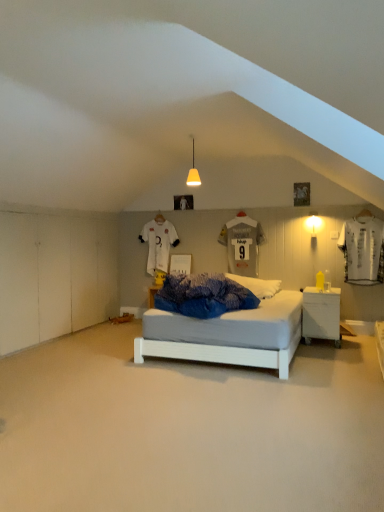
Question: Does white soft pillow at center have a greater height compared to gray matte jersey at center, arranged as the second t shirt when viewed from the back?

Choices:
 (A) yes
 (B) no

Answer: (B)

Question: Is white soft pillow at center in contact with gray matte jersey at center, arranged as the second t shirt when viewed from the back?

Choices:
 (A) yes
 (B) no

Answer: (B)

Question: Is white soft pillow at center oriented towards gray matte jersey at center, the first t shirt in the right-to-left sequence?

Choices:
 (A) yes
 (B) no

Answer: (B)

Question: Is gray matte jersey at center, which is the 2th t shirt in left-to-right order, a part of white soft pillow at center?

Choices:
 (A) no
 (B) yes

Answer: (A)

Question: Is white soft pillow at center far from gray matte jersey at center, arranged as the second t shirt when viewed from the back?

Choices:
 (A) no
 (B) yes

Answer: (A)

Question: Does white soft pillow at center have a lesser width compared to gray matte jersey at center, the 1th t shirt when ordered from front to back?

Choices:
 (A) no
 (B) yes

Answer: (A)

Question: From a real-world perspective, is white jersey at upper center, the 2th t shirt when ordered from front to back, physically below white matte wall sconce at right, which ranks as the second light fixture in top-to-bottom order?

Choices:
 (A) yes
 (B) no

Answer: (A)

Question: Is white matte wall sconce at right, acting as the first light fixture starting from the bottom, completely or partially inside white jersey at upper center, which is counted as the first t shirt, starting from the back?

Choices:
 (A) yes
 (B) no

Answer: (B)

Question: Are white jersey at upper center, which is counted as the first t shirt, starting from the back, and white matte wall sconce at right, acting as the 1th light fixture starting from the right, located far from each other?

Choices:
 (A) no
 (B) yes

Answer: (B)

Question: Can you confirm if white jersey at upper center, the 2th t shirt when ordered from front to back, is bigger than white matte wall sconce at right, acting as the first light fixture starting from the bottom?

Choices:
 (A) no
 (B) yes

Answer: (B)

Question: Does white jersey at upper center, positioned as the first t shirt in left-to-right order, lie behind white matte wall sconce at right, which ranks as the second light fixture in top-to-bottom order?

Choices:
 (A) yes
 (B) no

Answer: (A)

Question: Can you confirm if white jersey at upper center, which is counted as the first t shirt, starting from the back, is wider than white matte wall sconce at right, the 1th light fixture when ordered from back to front?

Choices:
 (A) yes
 (B) no

Answer: (B)

Question: Is white soft pillow at center at the left side of white glossy nightstand at lower right?

Choices:
 (A) no
 (B) yes

Answer: (B)